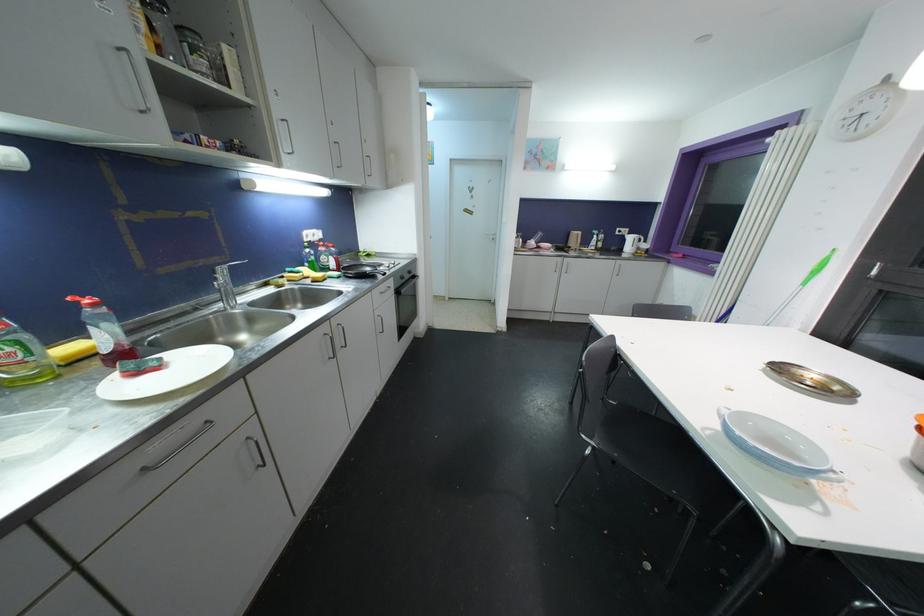
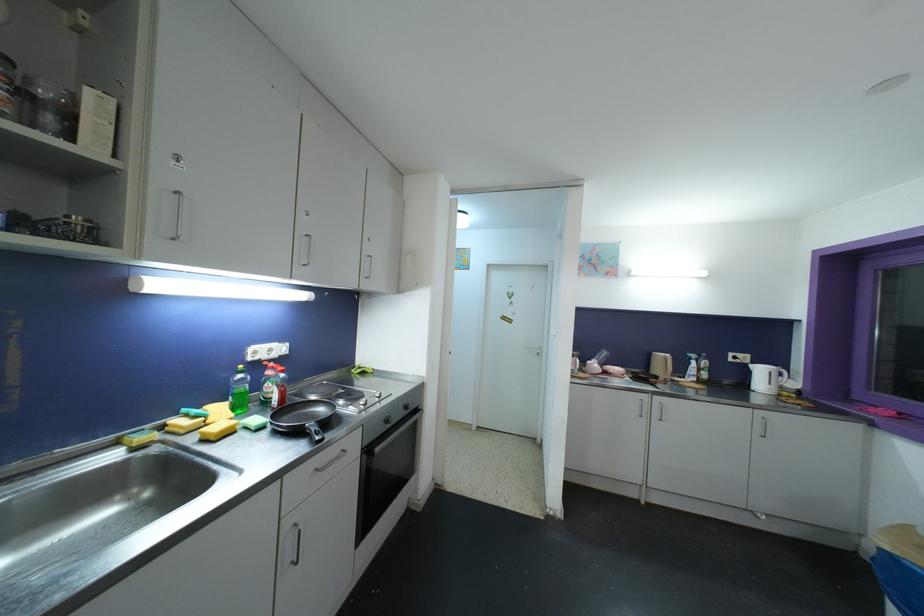
Locate, in the second image, the point that corresponds to (x=618, y=276) in the first image.

(760, 435)